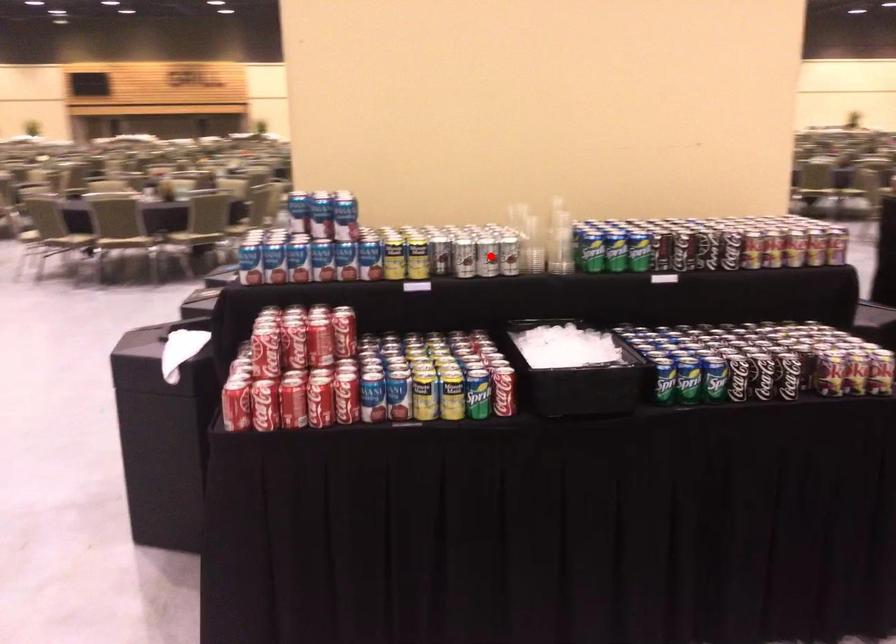
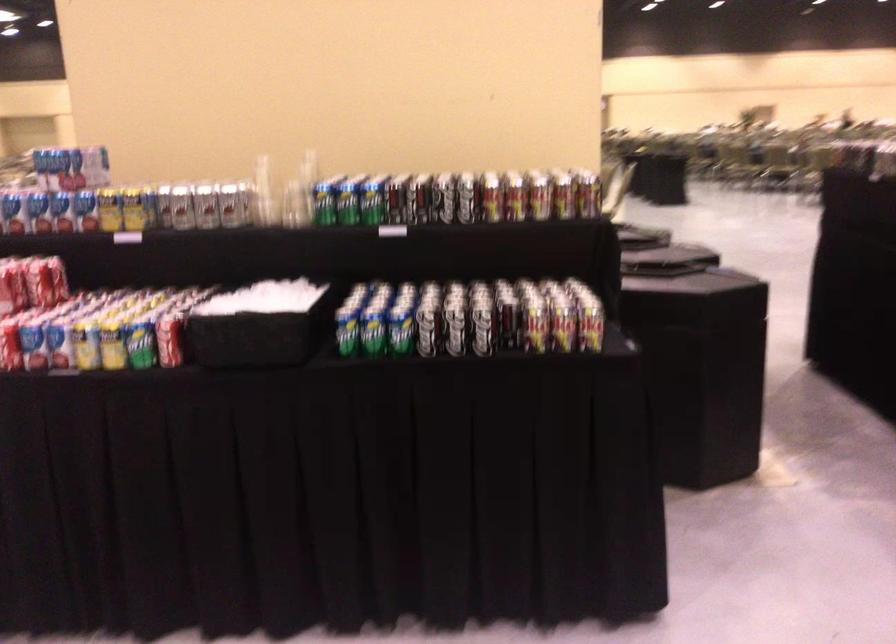
In the second image, find the point that corresponds to the highlighted location in the first image.

(205, 205)